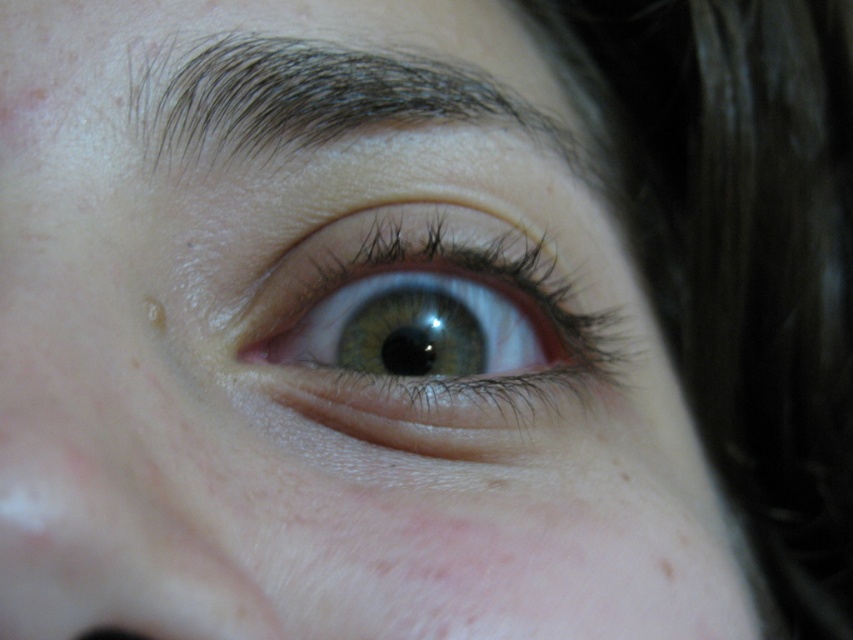
Which of these two, green glossy eye at center or dark brown hair at upper center, stands shorter?

dark brown hair at upper center is shorter.

Describe the element at coordinates (425, 326) in the screenshot. Image resolution: width=853 pixels, height=640 pixels. I see `green glossy eye at center` at that location.

Does point (498, 317) lie behind point (297, 108)?

Yes, point (498, 317) is behind point (297, 108).

Find the location of `green glossy eye at center`. green glossy eye at center is located at coordinates [x=425, y=326].